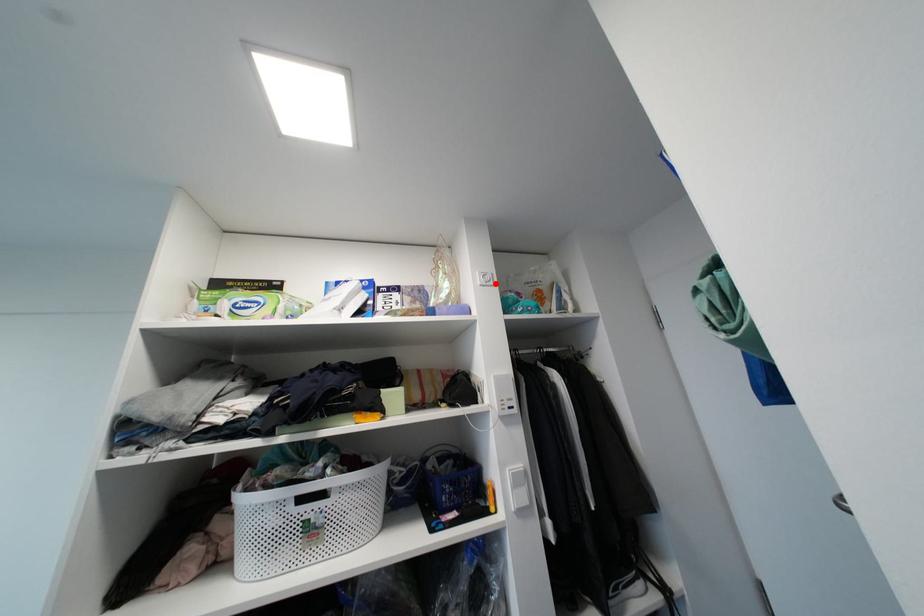
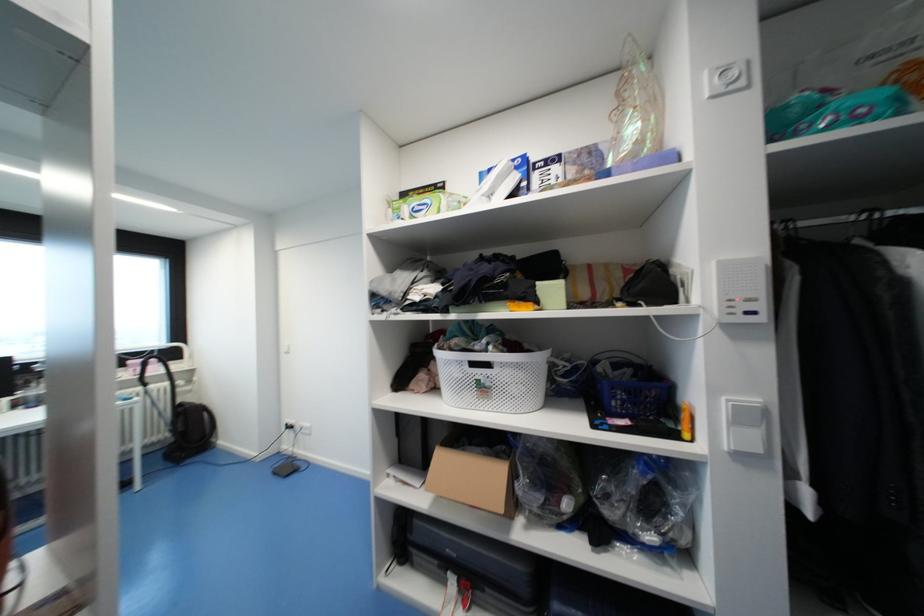
In the second image, find the point that corresponds to the highlighted location in the first image.

(747, 84)